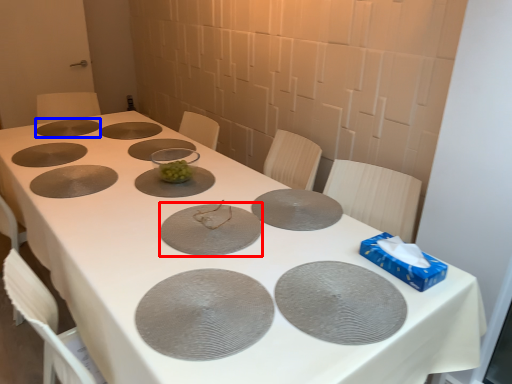
Question: Which object is closer to the camera taking this photo, glass plate (highlighted by a red box) or glass plate (highlighted by a blue box)?

Choices:
 (A) glass plate
 (B) glass plate

Answer: (A)